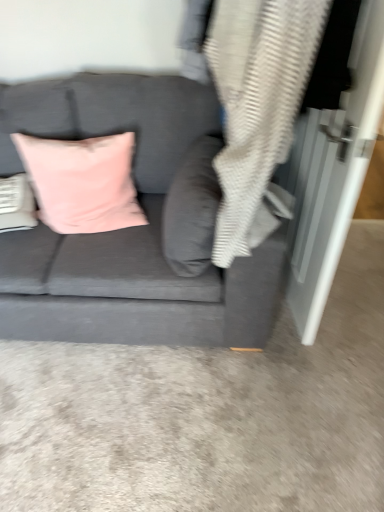
Question: From a real-world perspective, is velvet pink pillow at center, arranged as the 2th pillow when viewed from the left, on top of pink velvet cushion at upper left, positioned as the first pillow in left-to-right order?

Choices:
 (A) no
 (B) yes

Answer: (B)

Question: Is velvet pink pillow at center, marked as the first pillow in a right-to-left arrangement, turned away from pink velvet cushion at upper left, which ranks as the second pillow in right-to-left order?

Choices:
 (A) no
 (B) yes

Answer: (A)

Question: Can you confirm if velvet pink pillow at center, marked as the first pillow in a right-to-left arrangement, is bigger than pink velvet cushion at upper left, positioned as the first pillow in left-to-right order?

Choices:
 (A) no
 (B) yes

Answer: (A)

Question: Does velvet pink pillow at center, marked as the first pillow in a right-to-left arrangement, appear on the right side of pink velvet cushion at upper left, which ranks as the second pillow in right-to-left order?

Choices:
 (A) no
 (B) yes

Answer: (B)

Question: Can you confirm if velvet pink pillow at center, marked as the first pillow in a right-to-left arrangement, is taller than pink velvet cushion at upper left, positioned as the first pillow in left-to-right order?

Choices:
 (A) no
 (B) yes

Answer: (B)

Question: Is gray textured blanket at upper right to the left or to the right of pink velvet cushion at upper left, which ranks as the second pillow in right-to-left order, in the image?

Choices:
 (A) right
 (B) left

Answer: (A)

Question: From a real-world perspective, is gray textured blanket at upper right physically located above or below pink velvet cushion at upper left, which ranks as the second pillow in right-to-left order?

Choices:
 (A) above
 (B) below

Answer: (A)

Question: Looking at the image, does gray textured blanket at upper right seem bigger or smaller compared to pink velvet cushion at upper left, which ranks as the second pillow in right-to-left order?

Choices:
 (A) big
 (B) small

Answer: (A)

Question: Choose the correct answer: Is gray textured blanket at upper right inside pink velvet cushion at upper left, which ranks as the second pillow in right-to-left order, or outside it?

Choices:
 (A) inside
 (B) outside

Answer: (B)

Question: In the image, is velvet gray couch at center positioned in front of or behind pink velvet cushion at upper left, positioned as the first pillow in left-to-right order?

Choices:
 (A) behind
 (B) front

Answer: (B)

Question: Is velvet gray couch at center bigger or smaller than pink velvet cushion at upper left, positioned as the first pillow in left-to-right order?

Choices:
 (A) small
 (B) big

Answer: (B)

Question: Is velvet gray couch at center taller or shorter than pink velvet cushion at upper left, which ranks as the second pillow in right-to-left order?

Choices:
 (A) tall
 (B) short

Answer: (A)

Question: Is velvet gray couch at center situated inside pink velvet cushion at upper left, which ranks as the second pillow in right-to-left order, or outside?

Choices:
 (A) outside
 (B) inside

Answer: (A)

Question: In terms of height, does pink velvet cushion at upper left, positioned as the first pillow in left-to-right order, look taller or shorter compared to velvet pink pillow at center, arranged as the 2th pillow when viewed from the left?

Choices:
 (A) short
 (B) tall

Answer: (A)

Question: Based on their sizes in the image, would you say pink velvet cushion at upper left, which ranks as the second pillow in right-to-left order, is bigger or smaller than velvet pink pillow at center, marked as the first pillow in a right-to-left arrangement?

Choices:
 (A) big
 (B) small

Answer: (A)